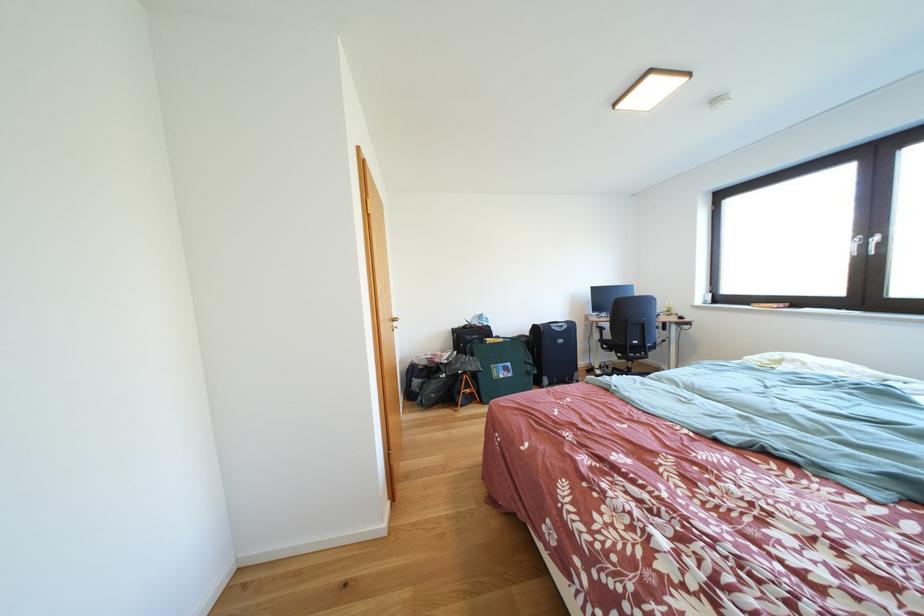
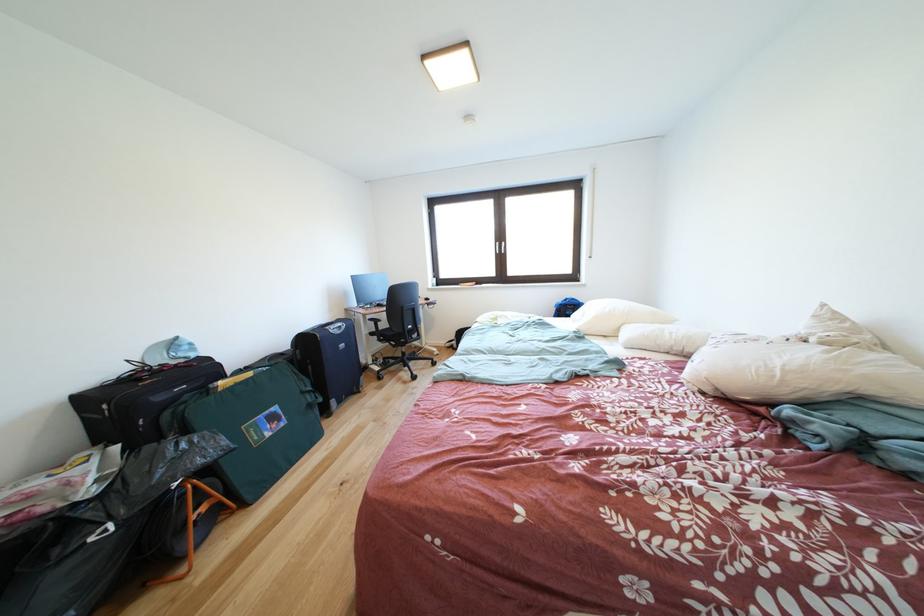
Find the pixel in the second image that matches (476,363) in the first image.

(191, 450)